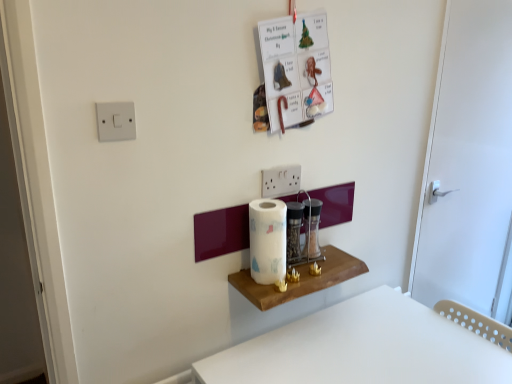
Question: Is white plastic table at lower right next to wooden shelf at center and touching it?

Choices:
 (A) yes
 (B) no

Answer: (B)

Question: Is white plastic table at lower right bigger than wooden shelf at center?

Choices:
 (A) yes
 (B) no

Answer: (A)

Question: Is white plastic table at lower right shorter than wooden shelf at center?

Choices:
 (A) no
 (B) yes

Answer: (A)

Question: From a real-world perspective, is white plastic table at lower right located higher than wooden shelf at center?

Choices:
 (A) yes
 (B) no

Answer: (B)

Question: Considering the relative sizes of white plastic table at lower right and wooden shelf at center in the image provided, is white plastic table at lower right smaller than wooden shelf at center?

Choices:
 (A) yes
 (B) no

Answer: (B)

Question: Considering the positions of white plastic table at lower right and white plastic light switch at upper left in the image, is white plastic table at lower right taller or shorter than white plastic light switch at upper left?

Choices:
 (A) short
 (B) tall

Answer: (B)

Question: From the image's perspective, is white plastic table at lower right positioned above or below white plastic light switch at upper left?

Choices:
 (A) below
 (B) above

Answer: (A)

Question: Is white plastic table at lower right in front of or behind white plastic light switch at upper left in the image?

Choices:
 (A) front
 (B) behind

Answer: (A)

Question: Is white plastic table at lower right wider or thinner than white plastic light switch at upper left?

Choices:
 (A) wide
 (B) thin

Answer: (A)

Question: From the image's perspective, is white matte door at right positioned above or below wooden shelf at center?

Choices:
 (A) below
 (B) above

Answer: (B)

Question: Looking at their shapes, would you say white matte door at right is wider or thinner than wooden shelf at center?

Choices:
 (A) thin
 (B) wide

Answer: (A)

Question: From a real-world perspective, is white matte door at right positioned above or below wooden shelf at center?

Choices:
 (A) above
 (B) below

Answer: (A)

Question: Relative to wooden shelf at center, is white matte door at right in front or behind?

Choices:
 (A) front
 (B) behind

Answer: (B)

Question: Is point (446, 79) closer or farther from the camera than point (381, 329)?

Choices:
 (A) farther
 (B) closer

Answer: (A)

Question: Based on their sizes in the image, would you say white matte door at right is bigger or smaller than white plastic table at lower right?

Choices:
 (A) big
 (B) small

Answer: (B)